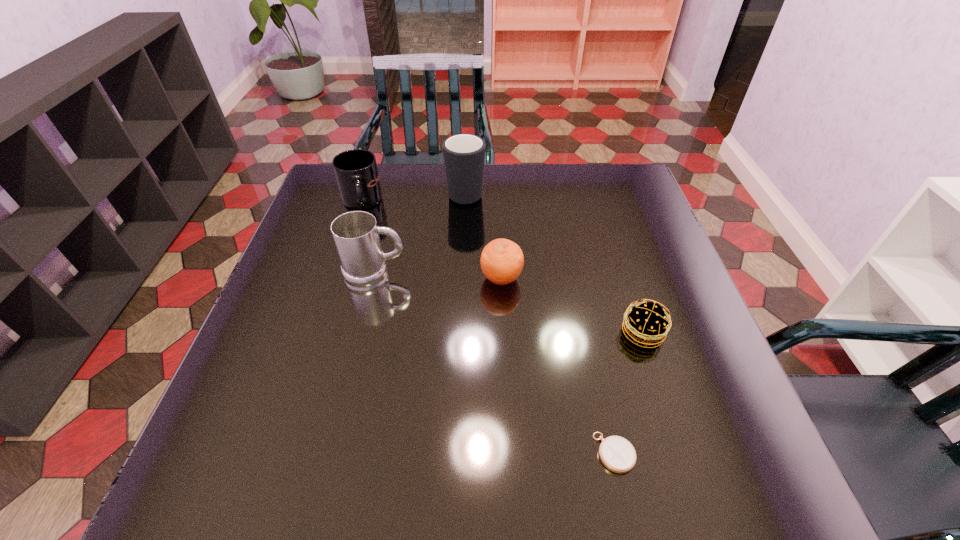
You are a GUI agent. You are given a task and a screenshot of the screen. Output one action in this format:
    pyautogui.click(x=<x>, y=<y>)
    Task: Click on the rightmost mug
    This screenshot has width=960, height=540.
    Given the screenshot: What is the action you would take?
    pyautogui.click(x=464, y=154)

At what (x,y) coordinates should I click in order to perform the action: click on the nearest mug. Please return your answer as a coordinate pair (x, y). The height and width of the screenshot is (540, 960). Looking at the image, I should click on (356, 235).

Where is `the fourth tallest object`? the fourth tallest object is located at coordinates (502, 260).

Locate an element on the screen. The image size is (960, 540). the rightmost object is located at coordinates (645, 324).

Locate an element on the screen. The image size is (960, 540). the second shortest object is located at coordinates (645, 324).

This screenshot has height=540, width=960. I want to click on the nearest object, so [x=617, y=454].

Locate an element on the screen. the shortest object is located at coordinates 617,454.

The width and height of the screenshot is (960, 540). I want to click on vacant space positioned on the side of the nearest mug with the handle, so coord(483,272).

The height and width of the screenshot is (540, 960). I want to click on vacant space located 0.130m on the left of the third shortest object, so click(427, 278).

This screenshot has height=540, width=960. I want to click on vacant space located 0.170m on the back of the fifth tallest object, so click(x=620, y=264).